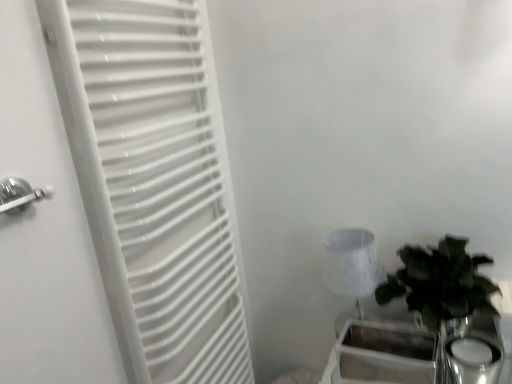
Identify the location of metallic silver tray at lower right. (398, 356).

Identify the location of white matte radiator at left. Image resolution: width=512 pixels, height=384 pixels. (158, 182).

What do you see at coordinates (158, 182) in the screenshot?
I see `white matte radiator at left` at bounding box center [158, 182].

Identify the location of white fabric lampshade at right. (352, 264).

Is metallic silver tray at lower right facing away from white fabric lampshade at right?

No, metallic silver tray at lower right's orientation is not away from white fabric lampshade at right.

From the image's perspective, would you say metallic silver tray at lower right is shown under white fabric lampshade at right?

Yes.

Who is bigger, metallic silver tray at lower right or white fabric lampshade at right?

white fabric lampshade at right is bigger.

Does metallic silver tray at lower right have a lesser height compared to white fabric lampshade at right?

Yes.

From the image's perspective, which one is positioned higher, white fabric lampshade at right or green leafy plant in glass vase at right?

From the image's view, white fabric lampshade at right is above.

Which object is further away from the camera taking this photo, white fabric lampshade at right or green leafy plant in glass vase at right?

white fabric lampshade at right is more distant.

How different are the orientations of white fabric lampshade at right and green leafy plant in glass vase at right in degrees?

The angle between the facing direction of white fabric lampshade at right and the facing direction of green leafy plant in glass vase at right is 1.19 degrees.

How far apart are white matte radiator at left and green leafy plant in glass vase at right?

white matte radiator at left and green leafy plant in glass vase at right are 66.37 centimeters apart.

In the scene shown: Is white matte radiator at left not inside green leafy plant in glass vase at right?

That's correct, white matte radiator at left is outside of green leafy plant in glass vase at right.

Is white matte radiator at left not near green leafy plant in glass vase at right?

Actually, white matte radiator at left and green leafy plant in glass vase at right are a little close together.

Does white matte radiator at left have a greater width compared to green leafy plant in glass vase at right?

No, white matte radiator at left is not wider than green leafy plant in glass vase at right.

Considering the relative positions of white matte radiator at left and metallic silver tray at lower right in the image provided, is white matte radiator at left to the left or to the right of metallic silver tray at lower right?

Clearly, white matte radiator at left is on the left of metallic silver tray at lower right in the image.

How much distance is there between white matte radiator at left and metallic silver tray at lower right?

white matte radiator at left is 24.49 inches from metallic silver tray at lower right.

Is point (180, 361) closer or farther from the camera than point (350, 377)?

Point (180, 361) appears to be closer to the viewer than point (350, 377).

From the image's perspective, is white matte radiator at left located above or below metallic silver tray at lower right?

Clearly, from the image's perspective, white matte radiator at left is above metallic silver tray at lower right.

Considering the positions of objects white matte radiator at left and white fabric lampshade at right in the image provided, who is behind, white matte radiator at left or white fabric lampshade at right?

white fabric lampshade at right is further from the camera.

Is white matte radiator at left facing away from white fabric lampshade at right?

white matte radiator at left does not have its back to white fabric lampshade at right.

Which object is positioned more to the left, white matte radiator at left or white fabric lampshade at right?

white matte radiator at left.

Is white fabric lampshade at right turned away from white matte radiator at left?

That's not correct — white fabric lampshade at right is not looking away from white matte radiator at left.

Relative to white matte radiator at left, is white fabric lampshade at right in front or behind?

Clearly, white fabric lampshade at right is behind white matte radiator at left.

Considering the relative positions of white fabric lampshade at right and white matte radiator at left in the image provided, is white fabric lampshade at right to the left of white matte radiator at left from the viewer's perspective?

No.

Between white fabric lampshade at right and white matte radiator at left, which one has more height?

white matte radiator at left.

In the scene shown: From a real-world perspective, is metallic silver tray at lower right above or below white matte radiator at left?

metallic silver tray at lower right is situated lower than white matte radiator at left in the real world.

Which point is more forward, [372,381] or [125,83]?

The point [125,83] is more forward.

Is metallic silver tray at lower right positioned far away from white matte radiator at left?

No, metallic silver tray at lower right is not far away from white matte radiator at left.

Can we say metallic silver tray at lower right lies outside white matte radiator at left?

Yes, metallic silver tray at lower right is outside of white matte radiator at left.

Identify the location of table below the white fabric lampshade at right (from the image's perspective). (398, 356).

Identify the location of lamp above the green leafy plant in glass vase at right (from the image's perspective). (352, 264).

Based on their spatial positions, is metallic silver tray at lower right or white matte radiator at left closer to white fabric lampshade at right?

Among the two, metallic silver tray at lower right is located nearer to white fabric lampshade at right.

Considering their positions, is white fabric lampshade at right positioned closer to metallic silver tray at lower right than white matte radiator at left?

white fabric lampshade at right is positioned closer to the anchor metallic silver tray at lower right.

Based on their spatial positions, is white matte radiator at left or metallic silver tray at lower right further from white fabric lampshade at right?

white matte radiator at left is further to white fabric lampshade at right.

Looking at the image, which one is located closer to green leafy plant in glass vase at right, white fabric lampshade at right or metallic silver tray at lower right?

The object closer to green leafy plant in glass vase at right is white fabric lampshade at right.

Estimate the real-world distances between objects in this image. Which object is further from green leafy plant in glass vase at right, white matte radiator at left or metallic silver tray at lower right?

The object further to green leafy plant in glass vase at right is white matte radiator at left.

Looking at this image, considering their positions, is white fabric lampshade at right positioned closer to white matte radiator at left than metallic silver tray at lower right?

white fabric lampshade at right.

When comparing their distances from metallic silver tray at lower right, does white matte radiator at left or green leafy plant in glass vase at right seem further?

white matte radiator at left lies further to metallic silver tray at lower right than the other object.

From the image, which object appears to be nearer to metallic silver tray at lower right, white fabric lampshade at right or green leafy plant in glass vase at right?

green leafy plant in glass vase at right.

What are the coordinates of `table between white matte radiator at left and green leafy plant in glass vase at right` in the screenshot? It's located at (398, 356).

You are a GUI agent. You are given a task and a screenshot of the screen. Output one action in this format:
    pyautogui.click(x=<x>, y=<y>)
    Task: Click on the lamp located between white matte radiator at left and metallic silver tray at lower right in the left-right direction
    This screenshot has width=512, height=384.
    Given the screenshot: What is the action you would take?
    pyautogui.click(x=352, y=264)

At what (x,y) coordinates should I click in order to perform the action: click on lamp situated between white matte radiator at left and green leafy plant in glass vase at right from left to right. Please return your answer as a coordinate pair (x, y). Looking at the image, I should click on (352, 264).

Where is `table between green leafy plant in glass vase at right and white fabric lampshade at right along the z-axis`? table between green leafy plant in glass vase at right and white fabric lampshade at right along the z-axis is located at coordinates (398, 356).